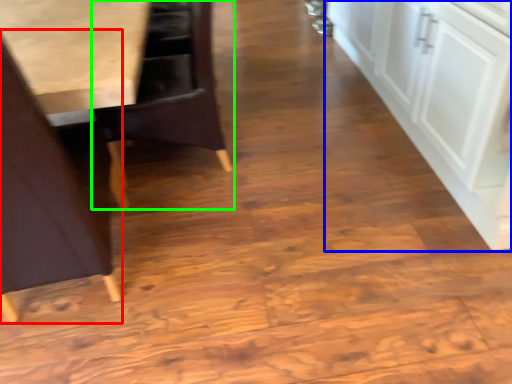
Question: Considering the real-world distances, which object is farthest from chair (highlighted by a red box)? cabinetry (highlighted by a blue box) or chair (highlighted by a green box)?

Choices:
 (A) cabinetry
 (B) chair

Answer: (A)